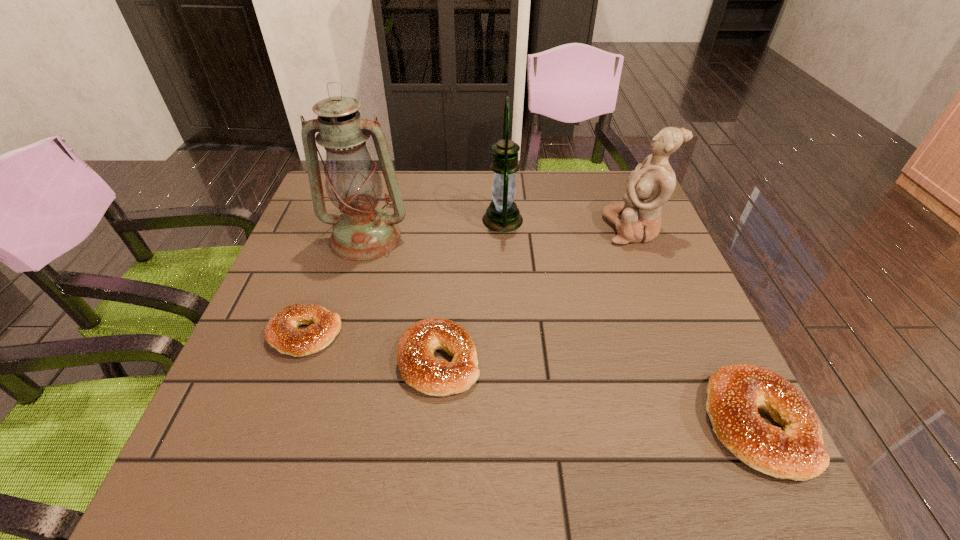
Image resolution: width=960 pixels, height=540 pixels. In order to click on vacant space located 0.320m on the left of the second shortest bagel in this screenshot , I will do `click(235, 361)`.

The image size is (960, 540). What are the coordinates of `free space located on the back of the rightmost bagel` in the screenshot? It's located at (672, 249).

Locate an element on the screen. The width and height of the screenshot is (960, 540). free space located 0.260m on the side where the lantern emits light is located at coordinates (387, 220).

The height and width of the screenshot is (540, 960). Find the location of `blank area located 0.320m on the side where the lantern emits light`. blank area located 0.320m on the side where the lantern emits light is located at coordinates (365, 220).

Where is `vacant space located on the side where the lantern emits light`? The width and height of the screenshot is (960, 540). vacant space located on the side where the lantern emits light is located at coordinates (375, 220).

Find the location of `vacant space located on the front of the oil lamp`. vacant space located on the front of the oil lamp is located at coordinates (338, 331).

The height and width of the screenshot is (540, 960). In order to click on free space located on the front-facing side of the third tallest object in this screenshot , I will do `click(544, 229)`.

Where is `vacant space situated 0.350m on the front-facing side of the third tallest object`? vacant space situated 0.350m on the front-facing side of the third tallest object is located at coordinates (473, 229).

The image size is (960, 540). Identify the location of vacant region located on the front-facing side of the third tallest object. (466, 229).

You are a GUI agent. You are given a task and a screenshot of the screen. Output one action in this format:
    pyautogui.click(x=<x>, y=<y>)
    Task: Click on the lantern present at the far edge
    
    Given the screenshot: What is the action you would take?
    pyautogui.click(x=502, y=215)